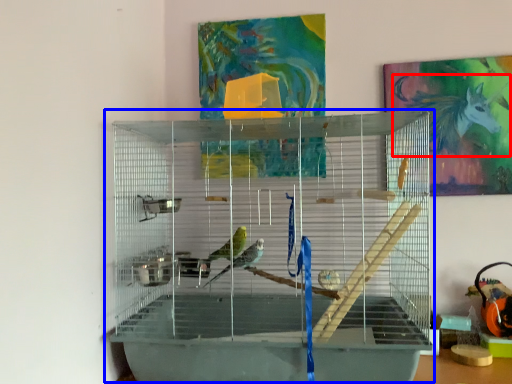
Question: Which of the following is the closest to the observer, animal (highlighted by a red box) or bird cage (highlighted by a blue box)?

Choices:
 (A) animal
 (B) bird cage

Answer: (B)